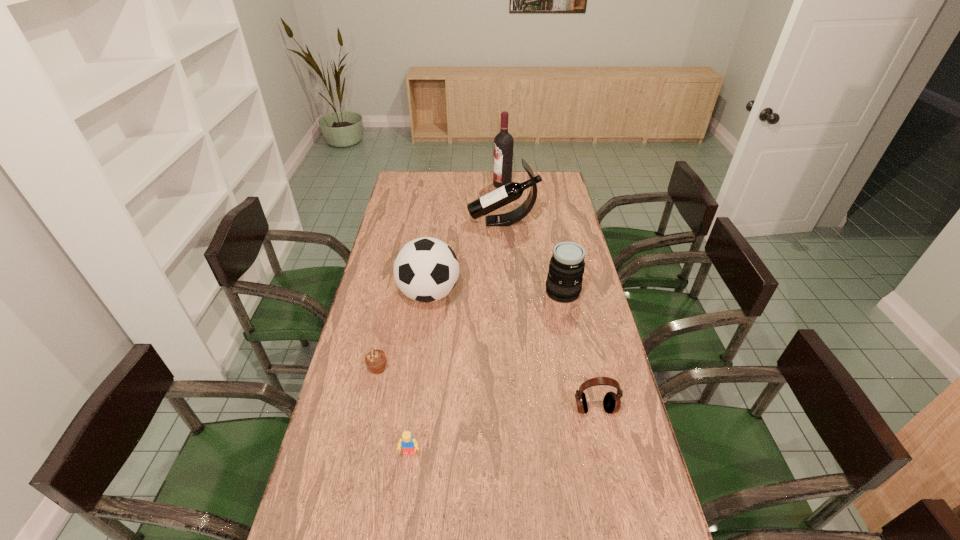
Where is `free space located on the label of the farther wine bottle`? The width and height of the screenshot is (960, 540). free space located on the label of the farther wine bottle is located at coordinates (446, 185).

Locate an element on the screen. vacant region located 0.380m on the label of the farther wine bottle is located at coordinates (419, 185).

Identify the location of vacant space located 0.160m on the label of the farther wine bottle. This screenshot has width=960, height=540. (462, 185).

Image resolution: width=960 pixels, height=540 pixels. Find the location of `free space located 0.330m on the stand of the sixth nearest object`. free space located 0.330m on the stand of the sixth nearest object is located at coordinates (395, 222).

The width and height of the screenshot is (960, 540). I want to click on vacant region located on the stand of the sixth nearest object, so click(432, 222).

Identify the location of free space located on the stand of the sixth nearest object. The width and height of the screenshot is (960, 540). (450, 222).

Locate an element on the screen. This screenshot has height=540, width=960. vacant space located on the right of the soccer ball is located at coordinates click(x=522, y=294).

Locate an element on the screen. This screenshot has width=960, height=540. free space located on the back of the telephoto lens is located at coordinates (559, 272).

Locate an element on the screen. This screenshot has width=960, height=540. free point located 0.260m on the ear pads of the fifth tallest object is located at coordinates (618, 516).

I want to click on free region located on the right of the third nearest object, so click(407, 369).